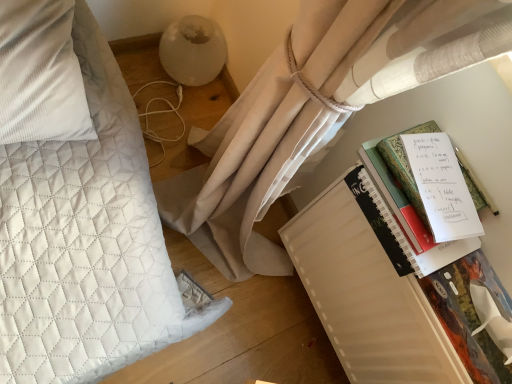
Question: Is hardcover book at right, which is the second paperback book from back to front, to the left of white quilted pillow at left from the viewer's perspective?

Choices:
 (A) no
 (B) yes

Answer: (A)

Question: Is white quilted pillow at left surrounded by hardcover book at right, which is the second paperback book from back to front?

Choices:
 (A) yes
 (B) no

Answer: (B)

Question: From the image's perspective, is hardcover book at right, which is the second paperback book from back to front, over white quilted pillow at left?

Choices:
 (A) yes
 (B) no

Answer: (B)

Question: Is hardcover book at right, which is the second paperback book from back to front, to the right of white quilted pillow at left from the viewer's perspective?

Choices:
 (A) yes
 (B) no

Answer: (A)

Question: Is hardcover book at right, which is the second paperback book from back to front, positioned with its back to white quilted pillow at left?

Choices:
 (A) yes
 (B) no

Answer: (B)

Question: Is point (345, 345) positioned closer to the camera than point (66, 61)?

Choices:
 (A) closer
 (B) farther

Answer: (B)

Question: From the image's perspective, relative to white quilted pillow at left, is white matte notebook at right, which is the first paperback book from back to front, above or below?

Choices:
 (A) above
 (B) below

Answer: (B)

Question: In terms of width, does white matte notebook at right, which is the first paperback book from back to front, look wider or thinner when compared to white quilted pillow at left?

Choices:
 (A) wide
 (B) thin

Answer: (B)

Question: Relative to white quilted pillow at left, is white matte notebook at right, positioned as the second paperback book in front-to-back order, in front or behind?

Choices:
 (A) front
 (B) behind

Answer: (B)

Question: From a real-world perspective, is white matte notebook at right, which is the first paperback book from back to front, positioned above or below hardcover book at right, which is the second paperback book from back to front?

Choices:
 (A) above
 (B) below

Answer: (B)

Question: Considering the positions of white matte notebook at right, positioned as the second paperback book in front-to-back order, and hardcover book at right, the first paperback book from the front, in the image, is white matte notebook at right, positioned as the second paperback book in front-to-back order, taller or shorter than hardcover book at right, the first paperback book from the front,?

Choices:
 (A) tall
 (B) short

Answer: (A)

Question: Looking at their shapes, would you say white matte notebook at right, which is the first paperback book from back to front, is wider or thinner than hardcover book at right, which is the second paperback book from back to front?

Choices:
 (A) wide
 (B) thin

Answer: (A)

Question: In the image, is white matte notebook at right, which is the first paperback book from back to front, positioned in front of or behind hardcover book at right, the first paperback book from the front?

Choices:
 (A) front
 (B) behind

Answer: (B)

Question: Does point (483, 281) appear closer or farther from the camera than point (406, 218)?

Choices:
 (A) closer
 (B) farther

Answer: (B)

Question: Is hardcover book at right, the first paperback book from the front, inside the boundaries of white paper notebook at right, or outside?

Choices:
 (A) inside
 (B) outside

Answer: (B)